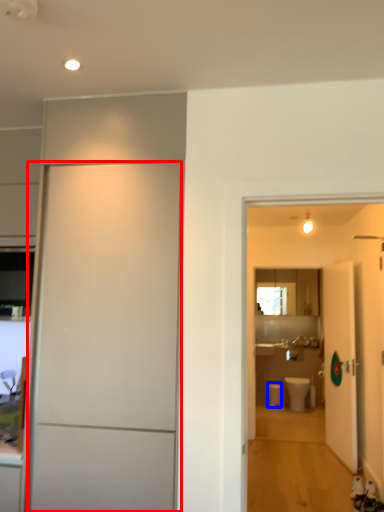
Question: Which object is closer to the camera taking this photo, door (highlighted by a red box) or toilet bowl (highlighted by a blue box)?

Choices:
 (A) door
 (B) toilet bowl

Answer: (A)